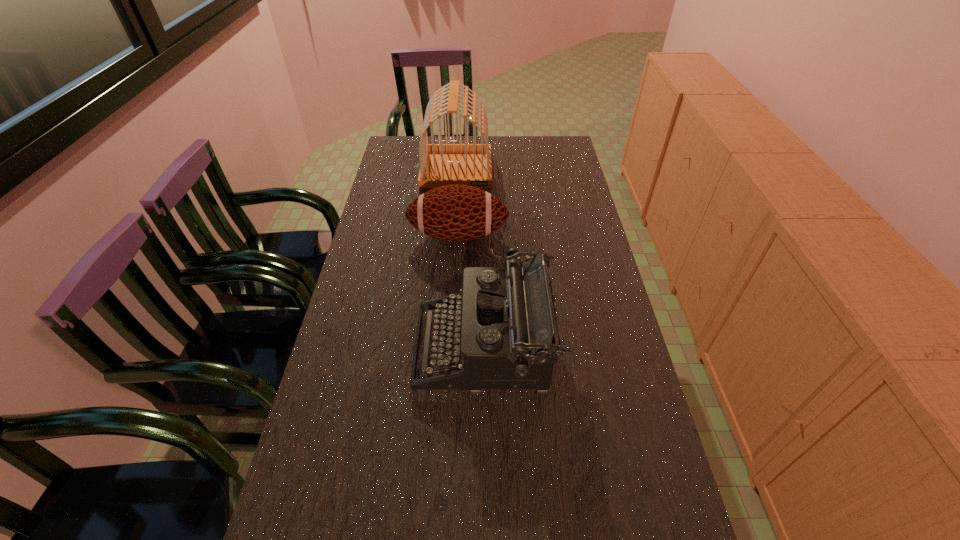
Find the location of a particular element. Image resolution: width=960 pixels, height=540 pixels. vacant space located 0.200m on the right of the second nearest object is located at coordinates (570, 236).

Locate an element on the screen. The image size is (960, 540). object that is at the far edge is located at coordinates (441, 164).

Identify the location of birdcage located at the left edge. Image resolution: width=960 pixels, height=540 pixels. (441, 164).

Where is `football present at the left edge`? This screenshot has height=540, width=960. football present at the left edge is located at coordinates (456, 213).

Find the location of `object at the far left corner`. object at the far left corner is located at coordinates tap(441, 164).

This screenshot has height=540, width=960. In the image, there is a desktop. Identify the location of vacant space at the far edge. (532, 166).

Image resolution: width=960 pixels, height=540 pixels. I want to click on vacant point at the left edge, so click(x=367, y=244).

Find the location of a particular element. The height and width of the screenshot is (540, 960). blank space at the right edge of the desktop is located at coordinates (574, 191).

This screenshot has width=960, height=540. In the image, there is a desktop. What are the coordinates of `vacant area at the far right corner` in the screenshot? It's located at (550, 159).

At what (x,y) coordinates should I click in order to perform the action: click on unoccupied area between the second shortest object and the farthest object. Please return your answer as a coordinate pair (x, y). Looking at the image, I should click on pos(470,259).